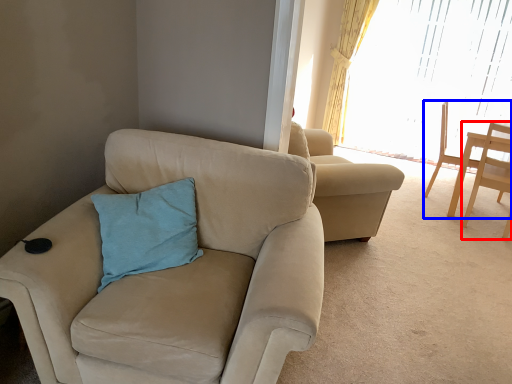
Question: Which point is closer to the camera, chair (highlighted by a red box) or chair (highlighted by a blue box)?

Choices:
 (A) chair
 (B) chair

Answer: (A)